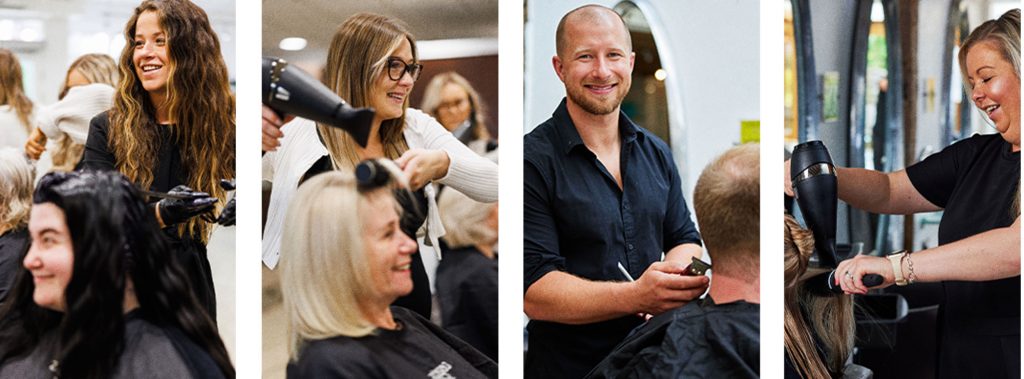
Locate an element on the screen. This screenshot has width=1024, height=379. ceiling light is located at coordinates (291, 41).